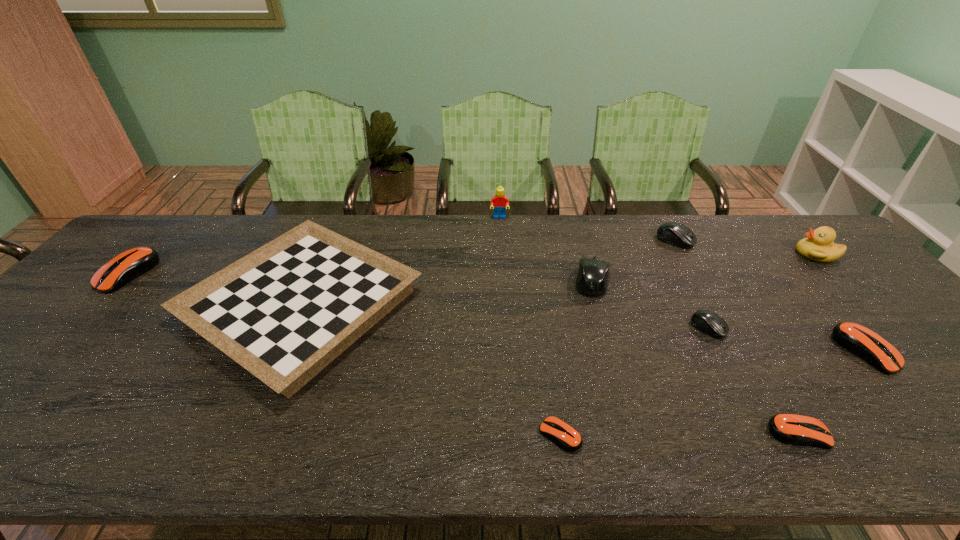
Identify the location of the farthest orange computer mouse. (125, 267).

This screenshot has width=960, height=540. What are the coordinates of `the second farthest orange computer mouse` in the screenshot? It's located at (859, 340).

In order to click on the second biggest orange computer mouse in this screenshot , I will do 859,340.

The image size is (960, 540). I want to click on the smallest black mouse, so click(x=708, y=322).

I want to click on the ninth tallest object, so click(793, 429).

Locate an element on the screen. Image resolution: width=960 pixels, height=540 pixels. the second orange computer mouse from right to left is located at coordinates (793, 429).

Identify the location of the smallest orange computer mouse. (564, 435).

Locate an element on the screen. This screenshot has width=960, height=540. the shortest object is located at coordinates (564, 435).

The width and height of the screenshot is (960, 540). In order to click on free region located 0.070m on the face of the farthest object in this screenshot , I will do `click(500, 233)`.

The height and width of the screenshot is (540, 960). Find the location of `vacant space located on the front-facing side of the yellow duckling`. vacant space located on the front-facing side of the yellow duckling is located at coordinates (673, 254).